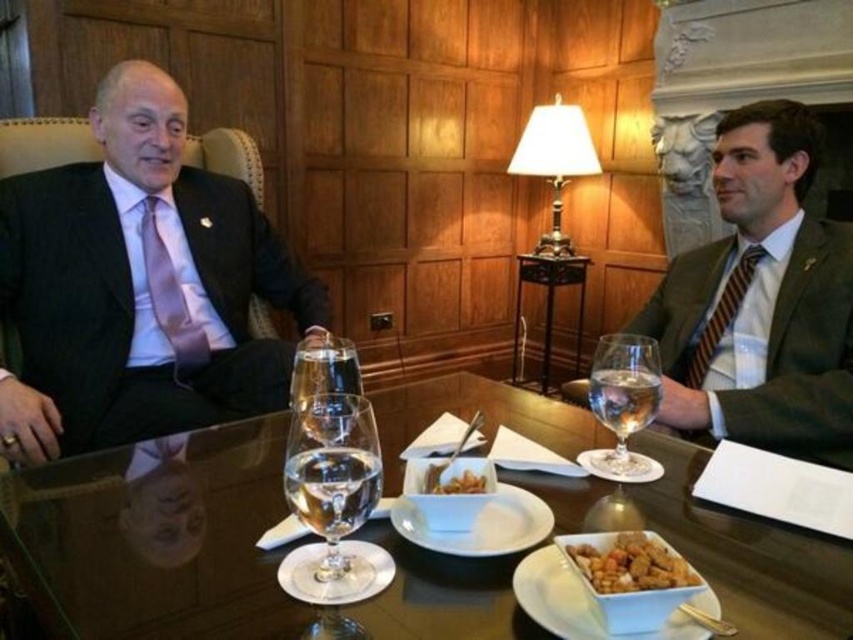
Who is positioned more to the right, clear glass water at center or striped fabric tie at right?

striped fabric tie at right is more to the right.

Is point (343, 416) behind point (755, 257)?

No, it is in front of (755, 257).

Where is `clear glass water at center`? Image resolution: width=853 pixels, height=640 pixels. clear glass water at center is located at coordinates (x=325, y=387).

Does golden crumbly bread at center have a lesser width compared to matte pink tie at left?

Indeed, golden crumbly bread at center has a lesser width compared to matte pink tie at left.

The width and height of the screenshot is (853, 640). Identify the location of golden crumbly bread at center. (630, 564).

Who is taller, matte black suit at left or white fabric lampshade at center?

matte black suit at left

Is point (151, 173) closer to camera compared to point (523, 134)?

Yes, it is in front of point (523, 134).

Which is in front, point (215, 342) or point (566, 243)?

Point (215, 342) is more forward.

This screenshot has width=853, height=640. What are the coordinates of `matte black suit at left` in the screenshot? It's located at (136, 285).